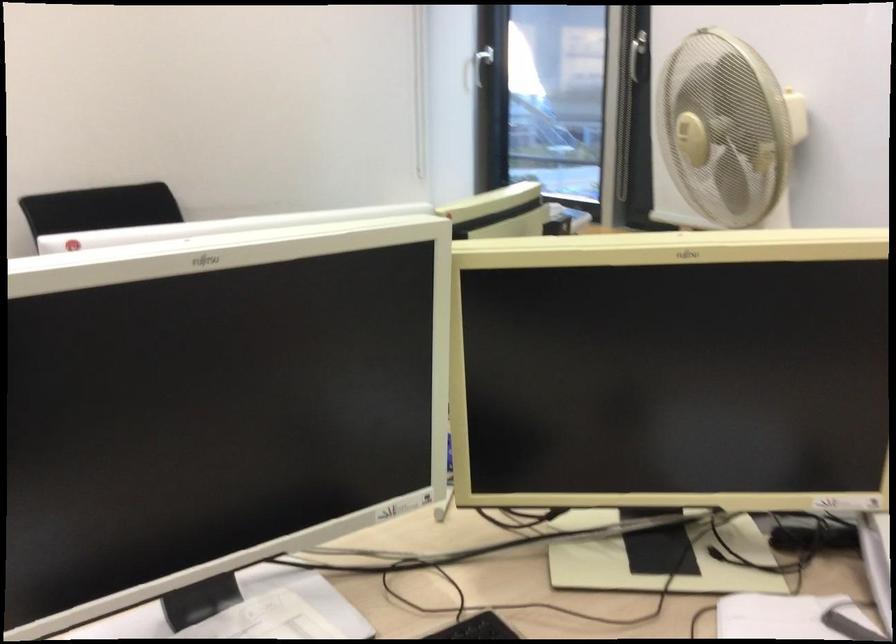
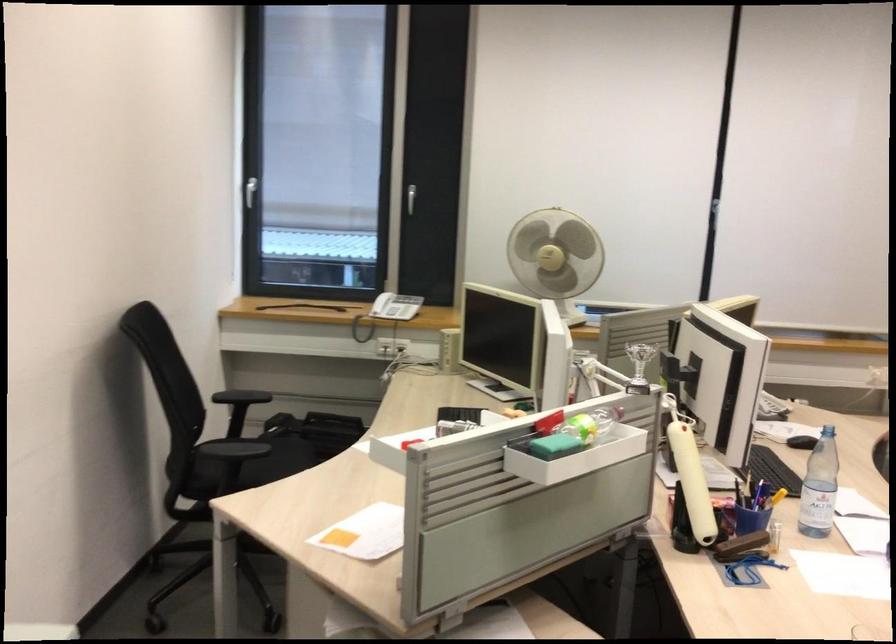
The point at (684, 162) is marked in the first image. Where is the corresponding point in the second image?

(556, 257)